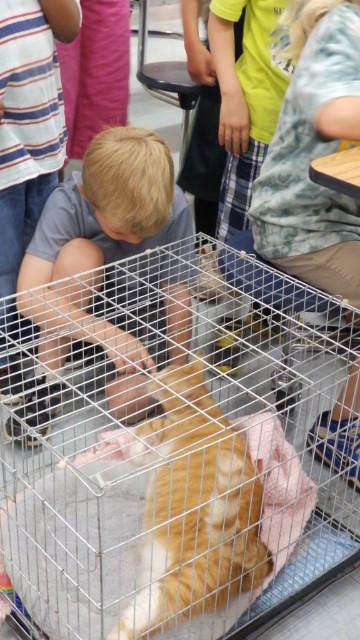
Who is taller, silver wire bird cage at center or orange fur cat at center?

silver wire bird cage at center is taller.

Is silver wire bird cage at center below orange fur cat at center?

Incorrect, silver wire bird cage at center is not positioned below orange fur cat at center.

This screenshot has width=360, height=640. What are the coordinates of `silver wire bird cage at center` in the screenshot? It's located at tap(186, 470).

Does light brown hair at center appear under orange fur cat at center?

No, light brown hair at center is not below orange fur cat at center.

Which is behind, point (69, 310) or point (209, 474)?

The point (69, 310) is more distant.

Locate an element on the screen. This screenshot has height=640, width=360. light brown hair at center is located at coordinates (108, 275).

Describe the element at coordinates (186, 470) in the screenshot. I see `silver wire bird cage at center` at that location.

Where is `silver wire bird cage at center`? silver wire bird cage at center is located at coordinates (186, 470).